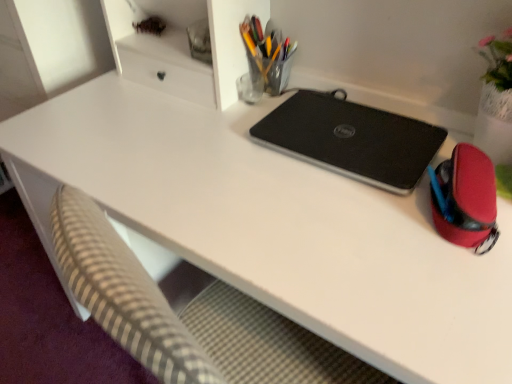
Image resolution: width=512 pixels, height=384 pixels. Describe the element at coordinates (465, 198) in the screenshot. I see `rubberized red pouch at right, which is the 2th stationery in left-to-right order` at that location.

How much space does rubberized red pouch at right, which is the 2th stationery in left-to-right order, occupy horizontally?

rubberized red pouch at right, which is the 2th stationery in left-to-right order, is 9.71 inches in width.

Describe the element at coordinates (267, 56) in the screenshot. I see `translucent glass pen holder at upper center, positioned as the first stationery in back-to-front order` at that location.

What is the approximate width of black matte laptop at center?

The width of black matte laptop at center is 11.50 inches.

Locate an element on the screen. Image resolution: width=512 pixels, height=384 pixels. rubberized red pouch at right, placed as the first stationery when sorted from bottom to top is located at coordinates (465, 198).

Is translucent glass pen holder at upper center, arranged as the first stationery when viewed from the left, further to camera compared to black matte laptop at center?

Yes, the depth of translucent glass pen holder at upper center, arranged as the first stationery when viewed from the left, is greater than that of black matte laptop at center.

Is translucent glass pen holder at upper center, positioned as the first stationery in back-to-front order, aimed at black matte laptop at center?

No, translucent glass pen holder at upper center, positioned as the first stationery in back-to-front order, does not turn towards black matte laptop at center.

Is translucent glass pen holder at upper center, marked as the second stationery in a right-to-left arrangement, located outside black matte laptop at center?

Yes, translucent glass pen holder at upper center, marked as the second stationery in a right-to-left arrangement, is not within black matte laptop at center.

How distant is translucent glass pen holder at upper center, positioned as the 2th stationery in bottom-to-top order, from black matte laptop at center?

They are 10.71 inches apart.

Considering the relative sizes of translucent glass pen holder at upper center, positioned as the 2th stationery in bottom-to-top order, and rubberized red pouch at right, the 1th stationery when ordered from right to left, in the image provided, is translucent glass pen holder at upper center, positioned as the 2th stationery in bottom-to-top order, smaller than rubberized red pouch at right, the 1th stationery when ordered from right to left,?

Yes.

Consider the image. Can you confirm if translucent glass pen holder at upper center, the 2th stationery in the front-to-back sequence, is wider than rubberized red pouch at right, which ranks as the second stationery in top-to-bottom order?

In fact, translucent glass pen holder at upper center, the 2th stationery in the front-to-back sequence, might be narrower than rubberized red pouch at right, which ranks as the second stationery in top-to-bottom order.

Is translucent glass pen holder at upper center, positioned as the first stationery in back-to-front order, oriented towards rubberized red pouch at right, the 1th stationery when ordered from right to left?

No, translucent glass pen holder at upper center, positioned as the first stationery in back-to-front order, is not turned towards rubberized red pouch at right, the 1th stationery when ordered from right to left.

How different are the orientations of translucent glass pen holder at upper center, arranged as the first stationery when viewed from the left, and rubberized red pouch at right, which is the second stationery in back-to-front order, in degrees?

translucent glass pen holder at upper center, arranged as the first stationery when viewed from the left, and rubberized red pouch at right, which is the second stationery in back-to-front order, are facing 17.3 degrees away from each other.

Can you tell me how much black matte laptop at center and rubberized red pouch at right, which is the 2th stationery in left-to-right order, differ in facing direction?

The angular difference between black matte laptop at center and rubberized red pouch at right, which is the 2th stationery in left-to-right order, is 17.1 degrees.

In the scene shown: Which is closer, (407, 140) or (473, 182)?

Point (407, 140) is positioned farther from the camera compared to point (473, 182).

From a real-world perspective, between black matte laptop at center and rubberized red pouch at right, which is the second stationery in back-to-front order, who is vertically lower?

black matte laptop at center.

Do you think black matte laptop at center is within rubberized red pouch at right, placed as the first stationery when sorted from bottom to top, or outside of it?

black matte laptop at center exists outside the volume of rubberized red pouch at right, placed as the first stationery when sorted from bottom to top.

Does point (286, 104) lie behind point (285, 86)?

That is False.

Is black matte laptop at center not within translucent glass pen holder at upper center, marked as the second stationery in a right-to-left arrangement?

Yes.

How far apart are black matte laptop at center and translucent glass pen holder at upper center, positioned as the first stationery in back-to-front order?

black matte laptop at center and translucent glass pen holder at upper center, positioned as the first stationery in back-to-front order, are 10.71 inches apart.

In the image, is rubberized red pouch at right, which ranks as the second stationery in top-to-bottom order, on the left side or the right side of black matte laptop at center?

In the image, rubberized red pouch at right, which ranks as the second stationery in top-to-bottom order, appears on the right side of black matte laptop at center.

Could you tell me if rubberized red pouch at right, the 1th stationery when ordered from right to left, is turned towards black matte laptop at center?

No, rubberized red pouch at right, the 1th stationery when ordered from right to left, is not aimed at black matte laptop at center.

Is point (466, 201) closer or farther from the camera than point (254, 17)?

Point (466, 201) is positioned closer to the camera compared to point (254, 17).

Looking at their sizes, would you say rubberized red pouch at right, arranged as the 1th stationery when viewed from the front, is wider or thinner than translucent glass pen holder at upper center, marked as the second stationery in a right-to-left arrangement?

rubberized red pouch at right, arranged as the 1th stationery when viewed from the front, is wider than translucent glass pen holder at upper center, marked as the second stationery in a right-to-left arrangement.

How distant is rubberized red pouch at right, which is the 2th stationery in left-to-right order, from translucent glass pen holder at upper center, which is the 1th stationery from top to bottom?

21.24 inches.

Locate an element on the screen. This screenshot has height=384, width=512. the 2nd stationery located above the black matte laptop at center (from a real-world perspective) is located at coordinates (267, 56).

In the image, there is a translucent glass pen holder at upper center, arranged as the first stationery when viewed from the left. Find the location of `stationery below it (from a real-world perspective)`. stationery below it (from a real-world perspective) is located at coordinates (465, 198).

Which object lies nearer to the anchor point black matte laptop at center, rubberized red pouch at right, which ranks as the second stationery in top-to-bottom order, or translucent glass pen holder at upper center, positioned as the 2th stationery in bottom-to-top order?

rubberized red pouch at right, which ranks as the second stationery in top-to-bottom order, lies closer to black matte laptop at center than the other object.

Estimate the real-world distances between objects in this image. Which object is further from translucent glass pen holder at upper center, positioned as the first stationery in back-to-front order, rubberized red pouch at right, the 1th stationery when ordered from right to left, or black matte laptop at center?

rubberized red pouch at right, the 1th stationery when ordered from right to left, lies further to translucent glass pen holder at upper center, positioned as the first stationery in back-to-front order, than the other object.

Looking at the image, which one is located further to rubberized red pouch at right, which is the 2th stationery in left-to-right order, translucent glass pen holder at upper center, marked as the second stationery in a right-to-left arrangement, or black matte laptop at center?

Among the two, translucent glass pen holder at upper center, marked as the second stationery in a right-to-left arrangement, is located further to rubberized red pouch at right, which is the 2th stationery in left-to-right order.

Based on their spatial positions, is translucent glass pen holder at upper center, arranged as the first stationery when viewed from the left, or rubberized red pouch at right, which ranks as the second stationery in top-to-bottom order, further from black matte laptop at center?

translucent glass pen holder at upper center, arranged as the first stationery when viewed from the left, is further to black matte laptop at center.

Looking at this image, estimate the real-world distances between objects in this image. Which object is further from translucent glass pen holder at upper center, positioned as the first stationery in back-to-front order, black matte laptop at center or rubberized red pouch at right, which is the second stationery in back-to-front order?

rubberized red pouch at right, which is the second stationery in back-to-front order, lies further to translucent glass pen holder at upper center, positioned as the first stationery in back-to-front order, than the other object.

Considering their positions, is black matte laptop at center positioned closer to rubberized red pouch at right, which is the second stationery in back-to-front order, than translucent glass pen holder at upper center, positioned as the first stationery in back-to-front order?

black matte laptop at center lies closer to rubberized red pouch at right, which is the second stationery in back-to-front order, than the other object.

This screenshot has width=512, height=384. What are the coordinates of `laptop between translucent glass pen holder at upper center, positioned as the first stationery in back-to-front order, and rubberized red pouch at right, arranged as the 1th stationery when viewed from the front` in the screenshot? It's located at (351, 139).